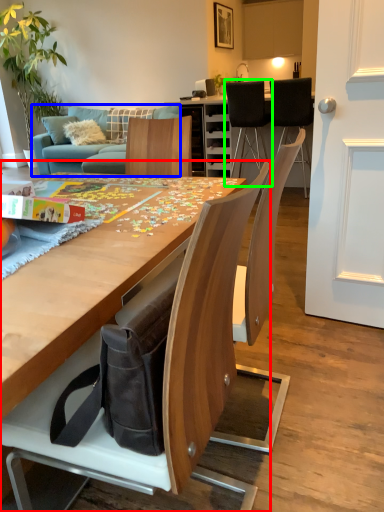
Question: Which object is positioned farthest from chair (highlighted by a red box)? Select from studio couch (highlighted by a blue box) and chair (highlighted by a green box).

Choices:
 (A) studio couch
 (B) chair

Answer: (B)